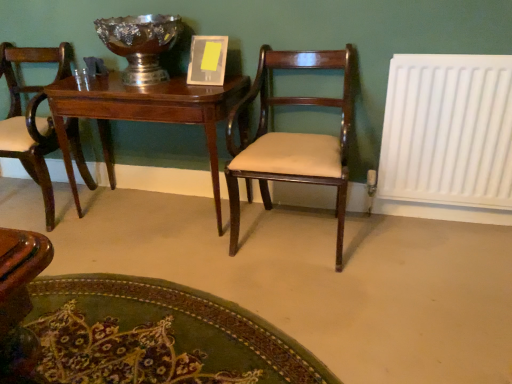
Image resolution: width=512 pixels, height=384 pixels. In order to click on vacant space that is in between mahogany wood table at center and mahogany wood chair at center, which is the 2th chair in left-to-right order in this screenshot , I will do `click(170, 238)`.